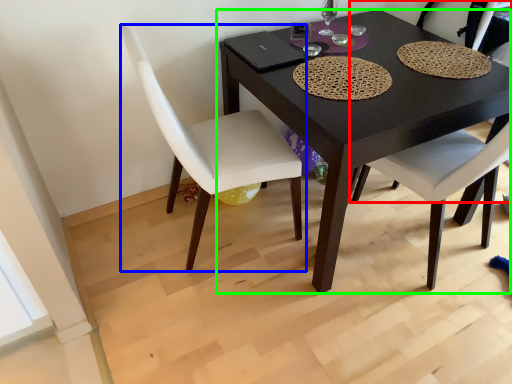
Question: Based on their relative distances, which object is nearer to chair (highlighted by a red box)? Choose from chair (highlighted by a blue box) and table (highlighted by a green box).

Choices:
 (A) chair
 (B) table

Answer: (B)